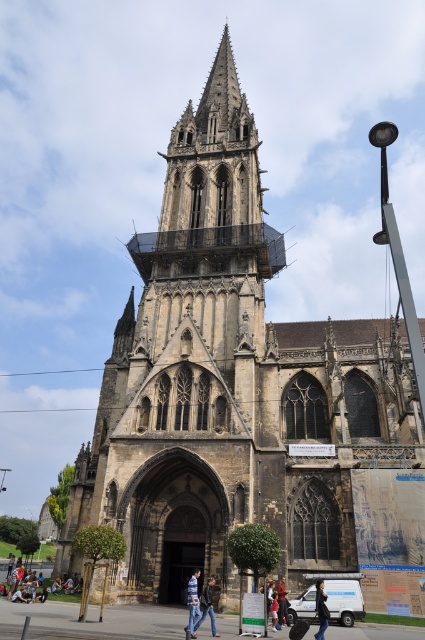
Question: Observing the image, what is the correct spatial positioning of denim jacket at lower center in reference to dark blue jeans at lower center?

Choices:
 (A) below
 (B) above

Answer: (B)

Question: Does striped shirt at center have a lesser width compared to dark blue fabric jacket at lower center?

Choices:
 (A) yes
 (B) no

Answer: (A)

Question: Considering the real-world distances, which object is farthest from the dark blue jeans at lower center?

Choices:
 (A) dark blue jeans at center
 (B) denim jacket at lower center
 (C) dark blue fabric jacket at lower center

Answer: (B)

Question: Is the position of dark blue jeans at lower center less distant than that of dark blue jeans at center?

Choices:
 (A) no
 (B) yes

Answer: (A)

Question: Which of the following is the closest to the observer?

Choices:
 (A) dark blue fabric jacket at lower center
 (B) striped shirt at center
 (C) denim jacket at lower center
 (D) dark blue jeans at lower center

Answer: (B)

Question: Estimate the real-world distances between objects in this image. Which object is closer to the dark blue jeans at center?

Choices:
 (A) dark blue fabric jacket at lower center
 (B) striped shirt at center

Answer: (A)